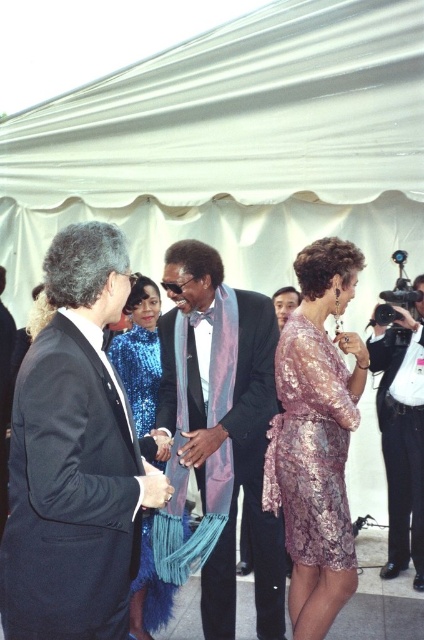
Who is shorter, lavender sequined dress at center or black leather jacket at right?

With less height is lavender sequined dress at center.

Can you confirm if lavender sequined dress at center is shorter than black leather jacket at right?

Yes.

Locate an element on the screen. The image size is (424, 640). lavender sequined dress at center is located at coordinates (317, 436).

The width and height of the screenshot is (424, 640). In order to click on lavender sequined dress at center in this screenshot , I will do `click(317, 436)`.

The image size is (424, 640). What do you see at coordinates (317, 436) in the screenshot?
I see `lavender sequined dress at center` at bounding box center [317, 436].

Between lavender sequined dress at center and blue sequined dress at center, which one is positioned higher?

blue sequined dress at center is above.

In order to click on lavender sequined dress at center in this screenshot , I will do `click(317, 436)`.

The height and width of the screenshot is (640, 424). In order to click on lavender sequined dress at center in this screenshot , I will do `click(317, 436)`.

Between point (127, 131) and point (228, 435), which one is positioned in front?

Point (228, 435) is in front.

The width and height of the screenshot is (424, 640). What do you see at coordinates (236, 148) in the screenshot?
I see `white fabric canopy at upper center` at bounding box center [236, 148].

I want to click on white fabric canopy at upper center, so click(236, 148).

Locate an element on the screen. The width and height of the screenshot is (424, 640). white fabric canopy at upper center is located at coordinates (236, 148).